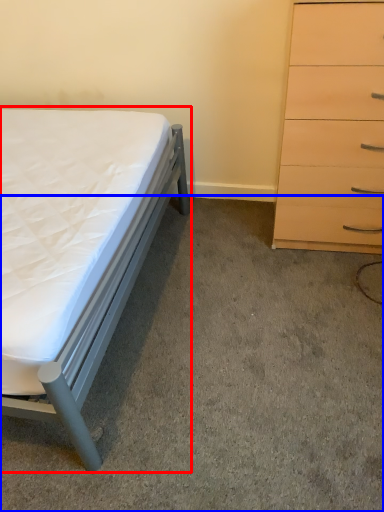
Question: Among these objects, which one is farthest to the camera, bed (highlighted by a red box) or concrete (highlighted by a blue box)?

Choices:
 (A) bed
 (B) concrete

Answer: (B)